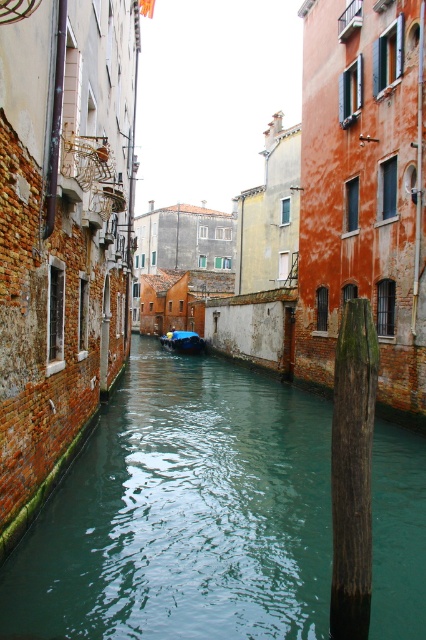
Which of these two, green water at center or green weathered wood post at center-right, stands shorter?

green water at center

Does point (282, 627) come farther from viewer compared to point (334, 513)?

Yes, point (282, 627) is behind point (334, 513).

Between point (117, 550) and point (367, 531), which one is positioned behind?

Positioned behind is point (117, 550).

Locate an element on the screen. The width and height of the screenshot is (426, 640). green water at center is located at coordinates (184, 513).

I want to click on green weathered wood post at center-right, so click(x=353, y=470).

Which is below, green weathered wood post at center-right or blue glossy boat at center?

blue glossy boat at center

Is point (345, 492) positioned in front of point (196, 346)?

That is True.

You are a GUI agent. You are given a task and a screenshot of the screen. Output one action in this format:
    pyautogui.click(x=<x>, y=<y>)
    Task: Click on the green weathered wood post at center-right
    
    Given the screenshot: What is the action you would take?
    click(x=353, y=470)

Does green water at center appear over blue glossy boat at center?

Actually, green water at center is below blue glossy boat at center.

Is green water at center bigger than blue glossy boat at center?

Indeed, green water at center has a larger size compared to blue glossy boat at center.

Between point (180, 452) and point (190, 352), which one is positioned behind?

Positioned behind is point (190, 352).

Image resolution: width=426 pixels, height=640 pixels. What are the coordinates of `green water at center` in the screenshot? It's located at (184, 513).